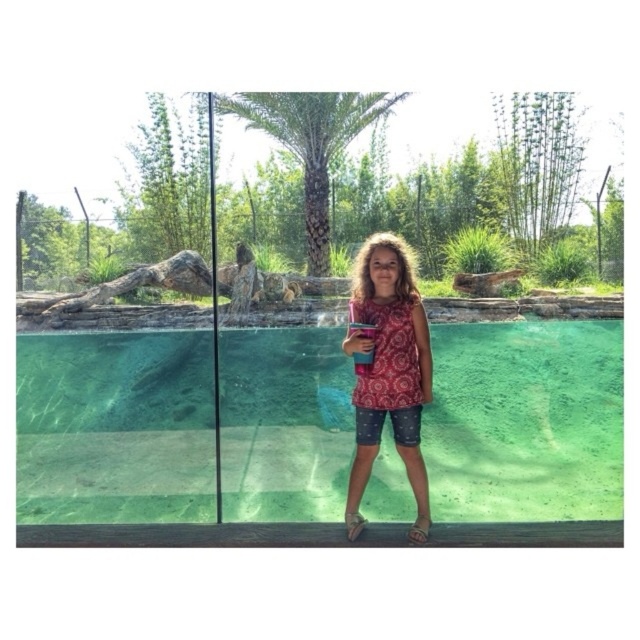
You are a zoo visitor who wants to take a photo of the aquatic animals through the transparent glass door at center. However, you are wearing a patterned fabric shirt at center. Will your shirt block the view of the animals through the glass?

The transparent glass door at center is bigger than patterned fabric shirt at center, so your shirt will not block the entire view of the animals through the glass.